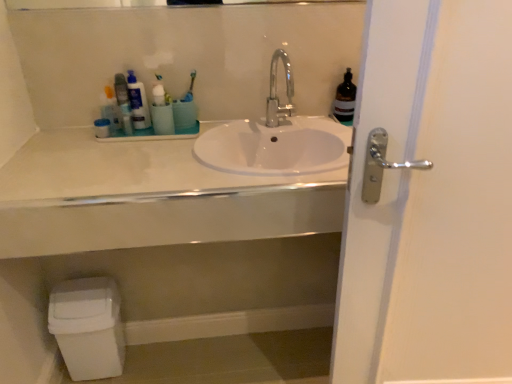
Question: Do you think blue plastic toothbrush at upper center is within white plastic toilet bowl at lower left, or outside of it?

Choices:
 (A) outside
 (B) inside

Answer: (A)

Question: Looking at their shapes, would you say blue plastic toothbrush at upper center is wider or thinner than white plastic toilet bowl at lower left?

Choices:
 (A) wide
 (B) thin

Answer: (B)

Question: Which of these objects is positioned farthest from the translucent plastic bottle at upper left, the 1th toiletry from the right?

Choices:
 (A) white plastic container at upper left, which is the 2th toiletry from right to left
 (B) polished chrome faucet at center
 (C) matte plastic container at upper left, placed as the 3th toiletry when sorted from right to left
 (D) blue plastic toothbrush at upper center
 (E) white glossy door handle at right

Answer: (E)

Question: Considering the real-world distances, which object is farthest from the polished chrome faucet at center?

Choices:
 (A) white plastic toilet bowl at lower left
 (B) translucent plastic bottle at upper left, which is counted as the third toiletry, starting from the left
 (C) white plastic container at upper left, which is the 2th toiletry from right to left
 (D) white glossy sink at center
 (E) matte plastic container at upper left, placed as the first toiletry when sorted from left to right

Answer: (A)